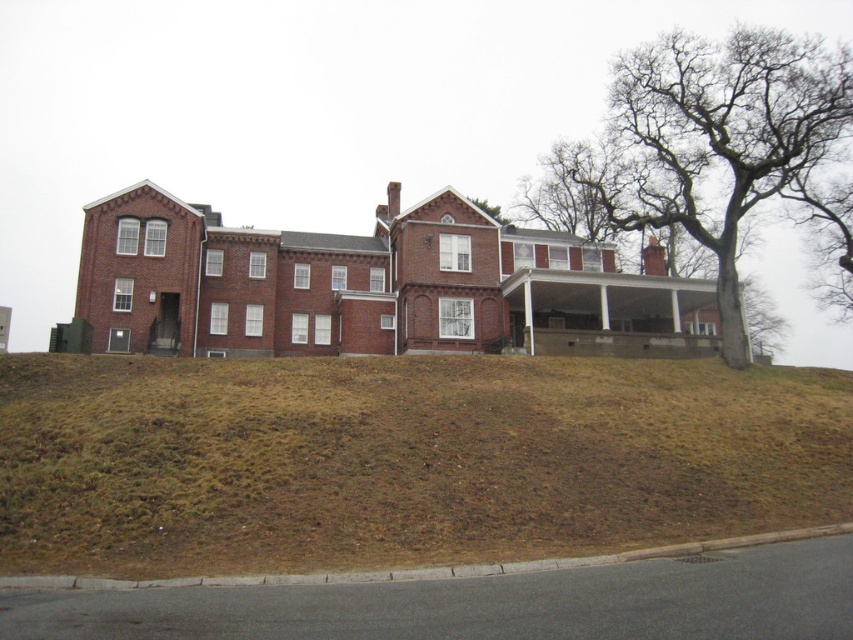
Question: Which object is closer to the camera taking this photo?

Choices:
 (A) brown grass at lower center
 (B) bare branches at upper right

Answer: (A)

Question: Among these points, which one is nearest to the camera?

Choices:
 (A) (701, 54)
 (B) (264, 541)

Answer: (B)

Question: Among these points, which one is nearest to the camera?

Choices:
 (A) (738, 358)
 (B) (589, 474)

Answer: (B)

Question: Is brown grass at lower center thinner than bare branches at upper right?

Choices:
 (A) no
 (B) yes

Answer: (B)

Question: Is brown grass at lower center bigger than bare branches at upper right?

Choices:
 (A) yes
 (B) no

Answer: (B)

Question: Does brown grass at lower center come in front of bare branches at upper right?

Choices:
 (A) yes
 (B) no

Answer: (A)